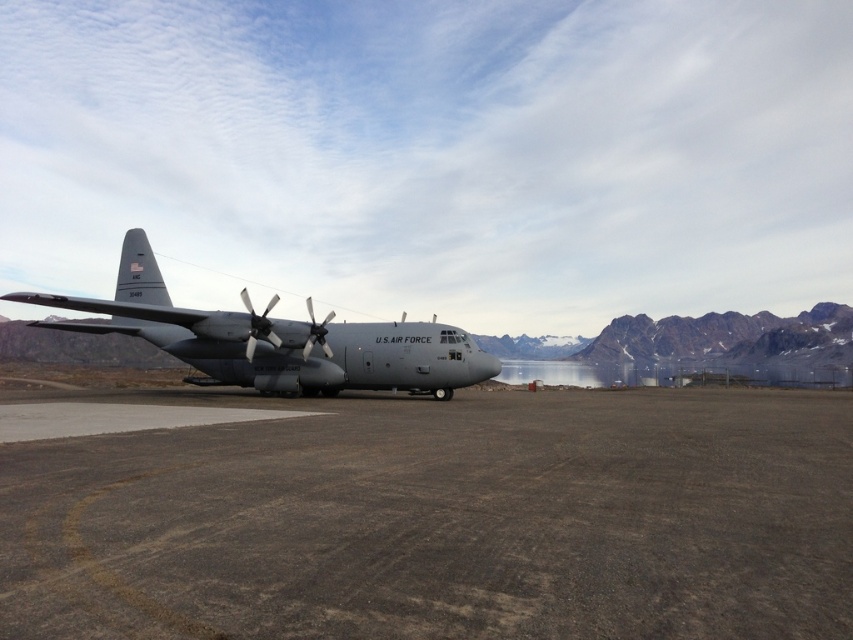
Consider the image. You are a pilot standing on the brown gravel at center. You need to board the gray matte airplane at center. Which direction should you walk to reach the airplane?

The brown gravel at center is to the right of the gray matte airplane at center, so you should walk to the left to reach the airplane.

You are standing at the point marked by the coordinates point (x=444, y=522). What type of terrain are you currently standing on?

You are standing on brown gravel at center.

You are a drone operator controlling a drone that needs to land on the brown gravel at center. The drone has a GPS coordinate system where the bottom left corner of the image is the origin point. What are the coordinates where you should direct the drone to land?

The coordinates for the brown gravel at center are at point (x=444, y=522), so you should direct the drone to land there.